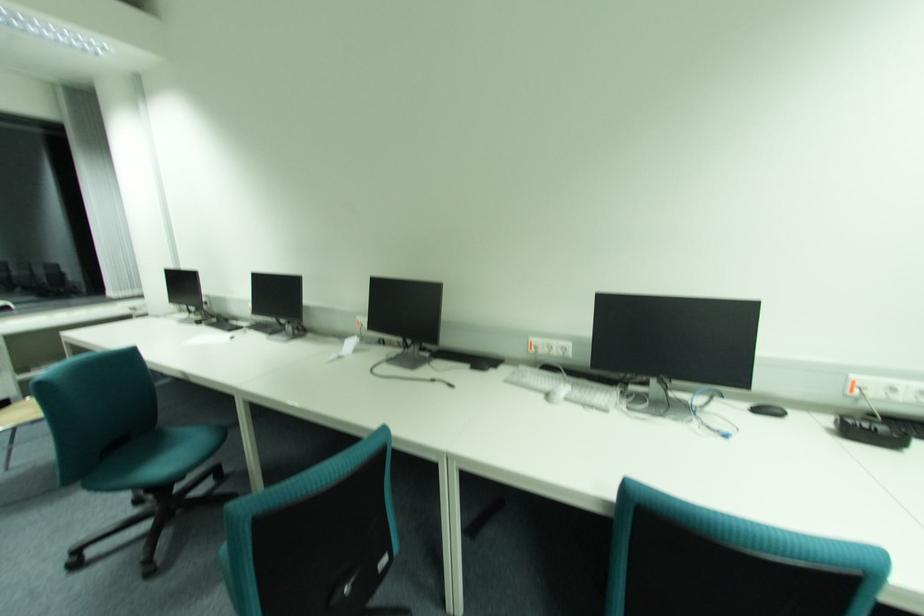
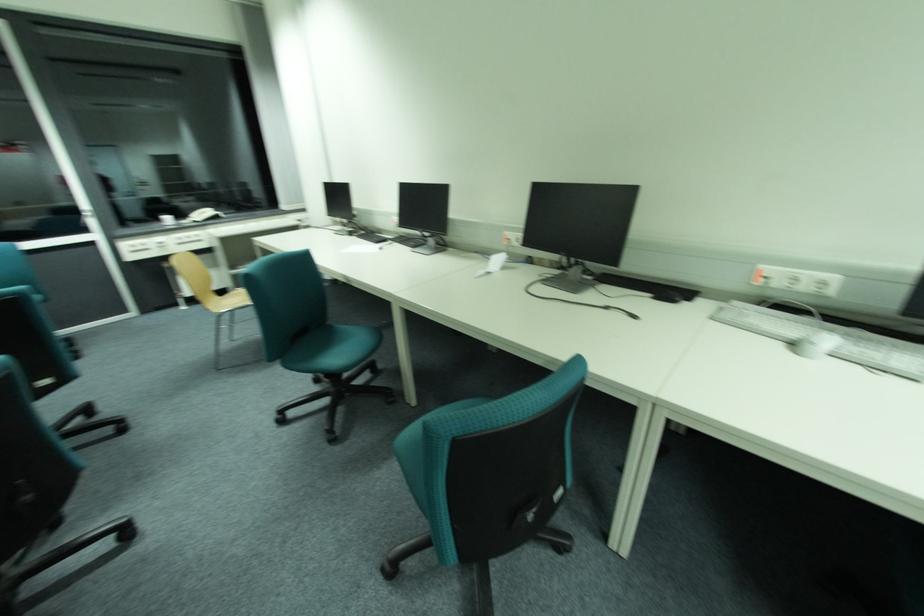
Locate, in the second image, the point that corresponds to (x=339, y=357) in the first image.

(487, 272)